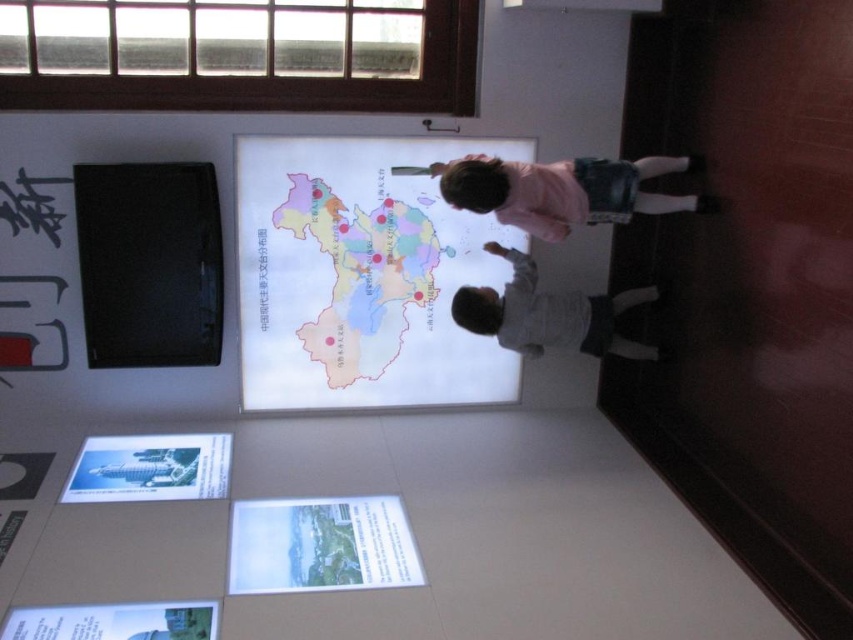
Question: Is white matte map at center bigger than gray cotton shirt at lower center?

Choices:
 (A) no
 (B) yes

Answer: (B)

Question: Which of the following is the farthest from the observer?

Choices:
 (A) white matte map at center
 (B) gray cotton shirt at lower center
 (C) pink fabric at upper right
 (D) map at center

Answer: (D)

Question: Based on their relative distances, which object is farther from the map at center?

Choices:
 (A) gray cotton shirt at lower center
 (B) pink fabric at upper right
 (C) white matte map at center

Answer: (B)

Question: Which of the following is the closest to the observer?

Choices:
 (A) pink fabric at upper right
 (B) gray cotton shirt at lower center
 (C) map at center

Answer: (A)

Question: Does white matte map at center appear on the left side of pink fabric at upper right?

Choices:
 (A) yes
 (B) no

Answer: (A)

Question: Is map at center closer to camera compared to gray cotton shirt at lower center?

Choices:
 (A) no
 (B) yes

Answer: (A)